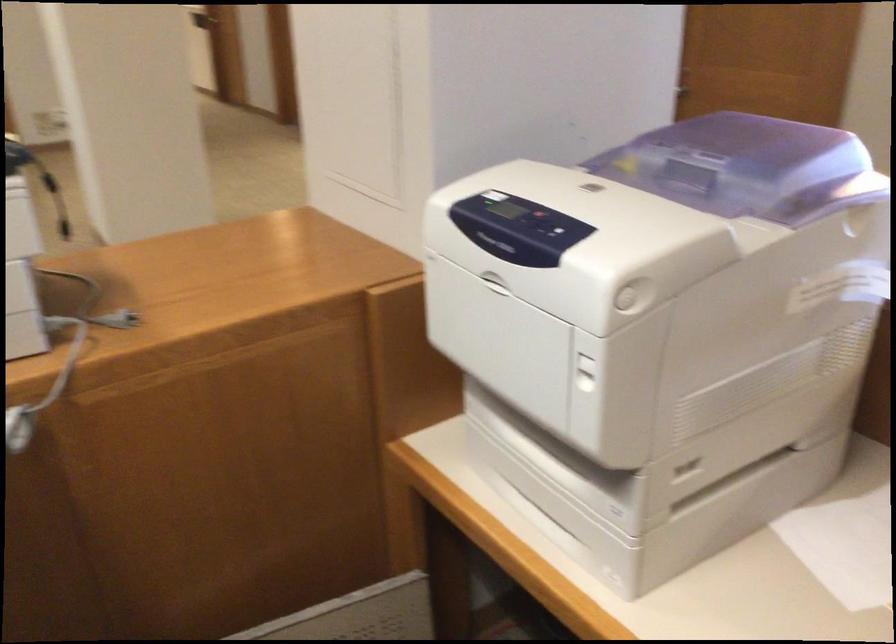
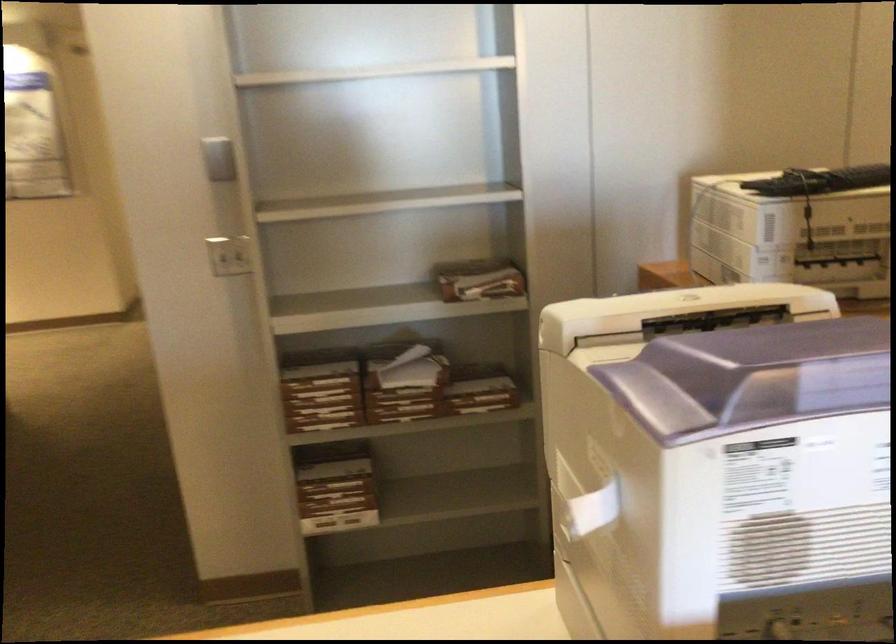
Locate, in the second image, the point that corresponds to pixel 794 131 in the first image.

(780, 368)